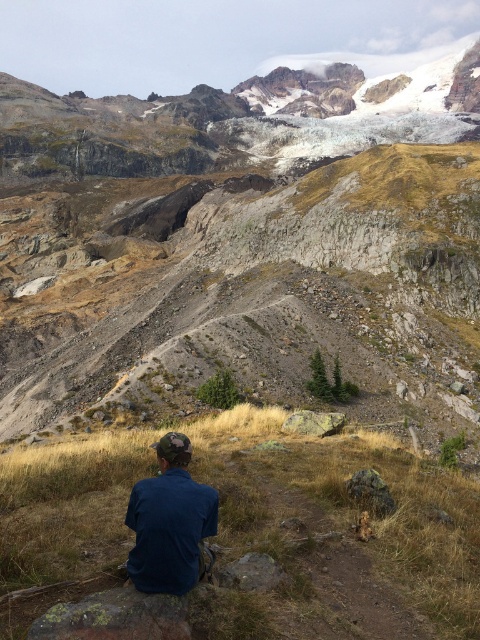
Question: Does rugged rock mountain at center appear on the right side of blue denim shirt at lower center?

Choices:
 (A) yes
 (B) no

Answer: (B)

Question: Can you confirm if rugged rock mountain at center is positioned above brown grassy hillside at lower center?

Choices:
 (A) no
 (B) yes

Answer: (B)

Question: Is brown grassy hillside at lower center further to the viewer compared to blue denim shirt at lower center?

Choices:
 (A) yes
 (B) no

Answer: (B)

Question: Which of the following is the closest to the observer?

Choices:
 (A) (295, 540)
 (B) (327, 122)

Answer: (A)

Question: Considering the real-world distances, which object is closest to the brown grassy hillside at lower center?

Choices:
 (A) rugged rock mountain at center
 (B) blue denim shirt at lower center

Answer: (B)

Question: Which object is closer to the camera taking this photo?

Choices:
 (A) blue denim shirt at lower center
 (B) brown grassy hillside at lower center
 (C) rugged rock mountain at center

Answer: (B)